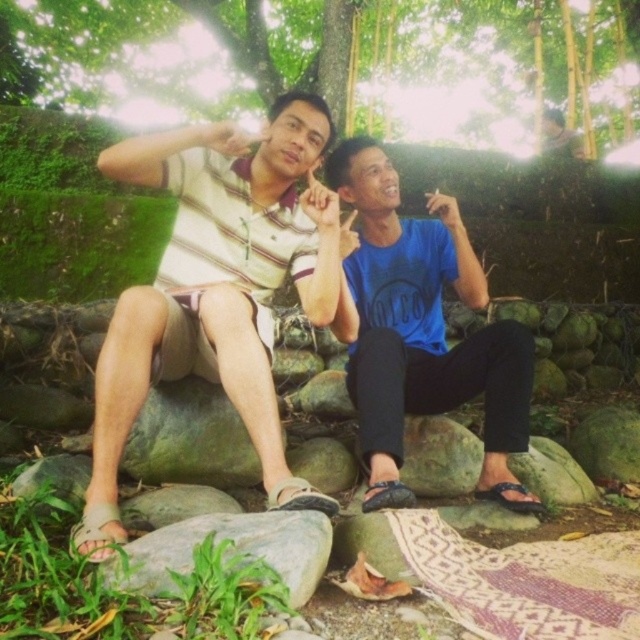
Does gray smooth rock at lower center lie behind green grass at lower left?

No.

Is gray smooth rock at lower center bigger than green grass at lower left?

Correct, gray smooth rock at lower center is larger in size than green grass at lower left.

Between point (189, 564) and point (42, 474), which one is positioned in front?

Point (189, 564)

What are the coordinates of `gray smooth rock at lower center` in the screenshot? It's located at (230, 547).

Does green leafy tree at upper center have a smaller size compared to gray smooth rock at lower center?

Yes, green leafy tree at upper center is smaller than gray smooth rock at lower center.

Does green leafy tree at upper center lie behind gray smooth rock at lower center?

Yes, green leafy tree at upper center is behind gray smooth rock at lower center.

This screenshot has width=640, height=640. In order to click on green leafy tree at upper center in this screenshot , I will do `click(348, 64)`.

Identify the location of green leafy tree at upper center. (348, 64).

Can you confirm if blue matte shirt at center is positioned to the right of green mossy rock at center?

Yes, blue matte shirt at center is to the right of green mossy rock at center.

Where is `blue matte shirt at center`? This screenshot has height=640, width=640. blue matte shirt at center is located at coordinates (x=420, y=332).